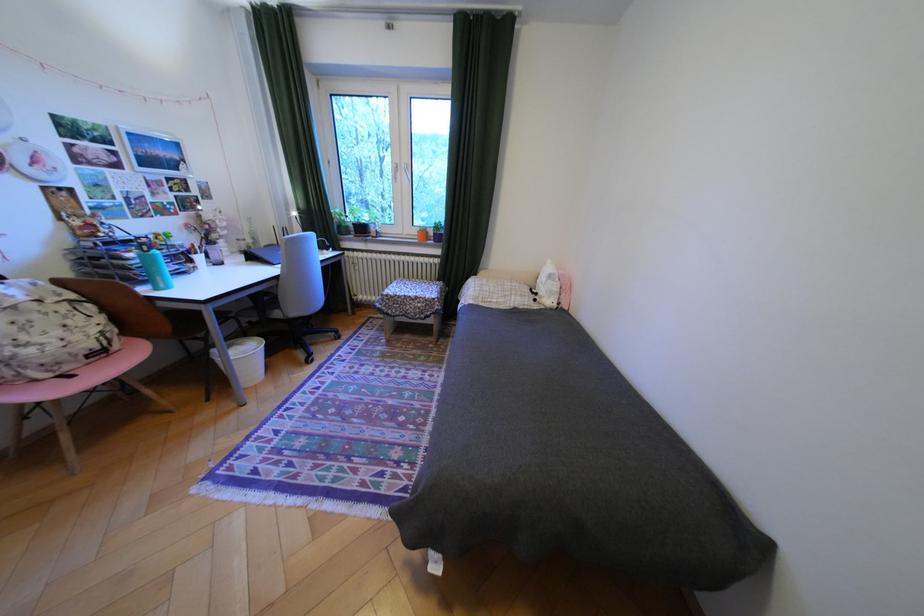
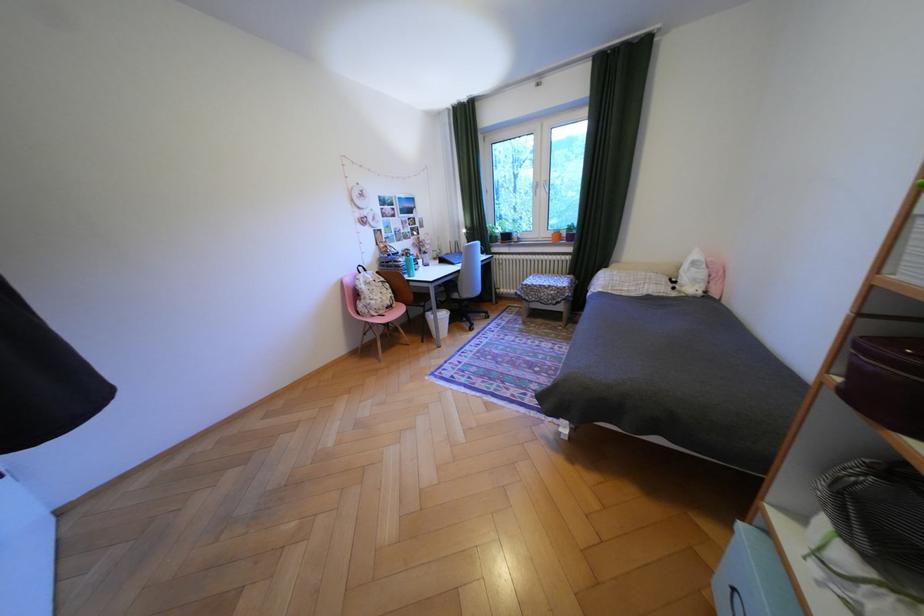
The point at (566, 305) is marked in the first image. Where is the corresponding point in the second image?

(712, 293)